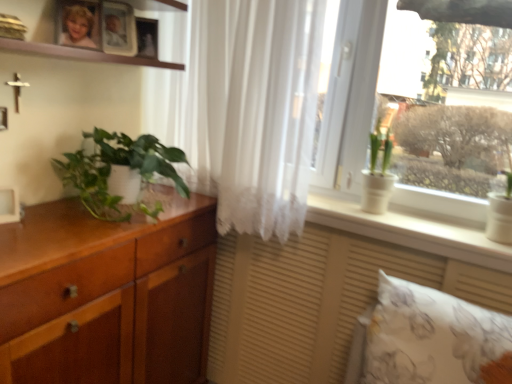
This screenshot has height=384, width=512. I want to click on free space below green glossy plant at left, arranged as the 2th houseplant when viewed from the right (from a real-world perspective), so click(144, 205).